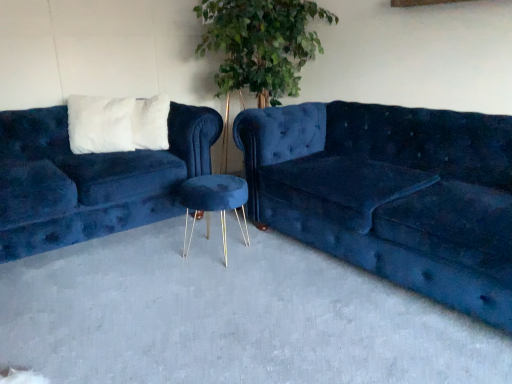
At what (x,y) coordinates should I click in order to perform the action: click on free spot in front of velvet blue stool at center. Please return your answer as a coordinate pair (x, y). The width and height of the screenshot is (512, 384). Looking at the image, I should click on (199, 276).